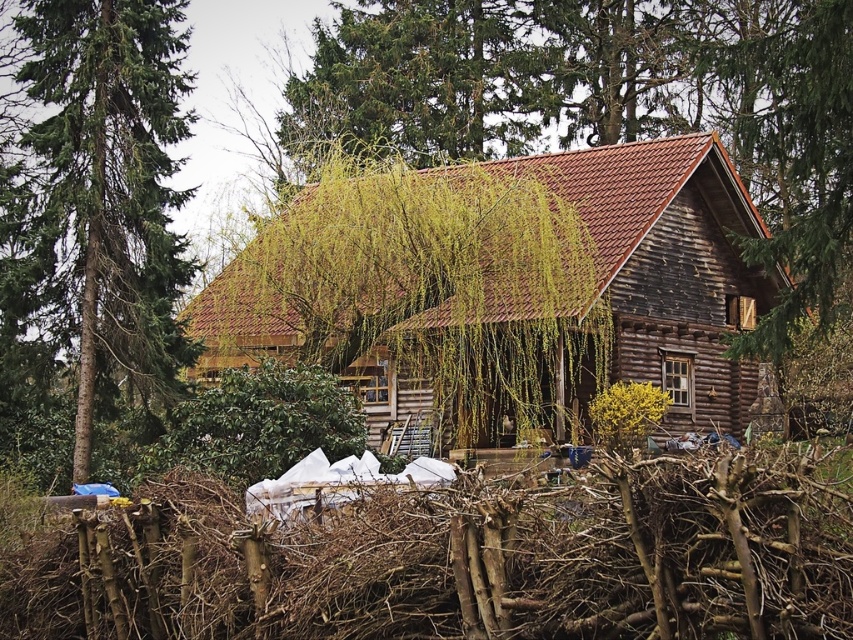
You are standing at the point with coordinates point (57, 138) and want to move towards the cabin. Is the point point (758, 524) blocking your path?

Point (758, 524) is in front of point (57, 138), so yes, the point point (758, 524) is blocking your path.

You are standing in front of the rustic wooden cabin and notice two points marked on the image. The first point is at coordinate point[802,506] and the second is at point[386,401]. Which of these two points is closer to you?

Point[802,506] is closer to the viewer than point[386,401].